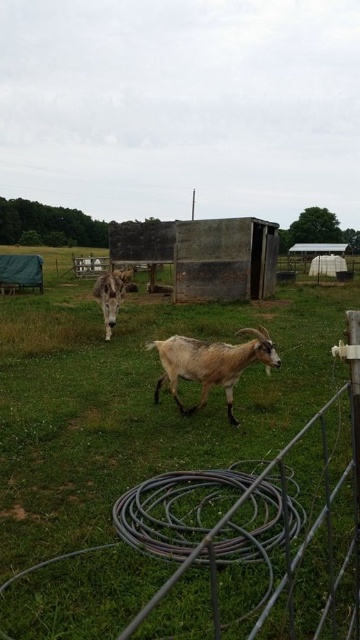
Question: Based on their relative distances, which object is farther from the green grassy field at center?

Choices:
 (A) brown fuzzy goat at center
 (B) brown woolen goat at center

Answer: (B)

Question: Which object appears closest to the camera in this image?

Choices:
 (A) green grassy field at center
 (B) brown fuzzy goat at center

Answer: (A)

Question: Which point is closer to the camera?

Choices:
 (A) (294, 323)
 (B) (115, 296)

Answer: (B)

Question: Is brown fuzzy goat at center above brown woolen goat at center?

Choices:
 (A) no
 (B) yes

Answer: (A)

Question: Is brown fuzzy goat at center positioned before brown woolen goat at center?

Choices:
 (A) no
 (B) yes

Answer: (B)

Question: Observing the image, what is the correct spatial positioning of green grassy field at center in reference to brown fuzzy goat at center?

Choices:
 (A) right
 (B) left

Answer: (A)